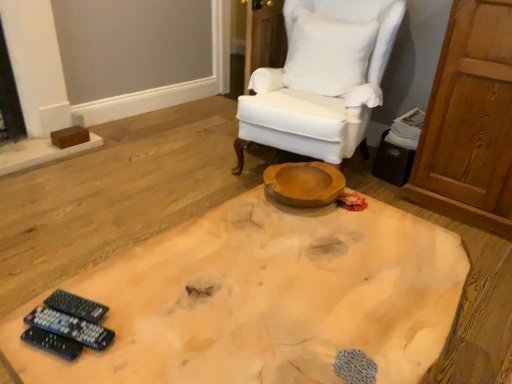
Question: Is black plastic remote controls at lower left, the 1th remote control viewed from the back, next to natural wood coffee table at center?

Choices:
 (A) yes
 (B) no

Answer: (B)

Question: Is black plastic remote controls at lower left, the 1th remote control viewed from the back, bigger than natural wood coffee table at center?

Choices:
 (A) no
 (B) yes

Answer: (A)

Question: Is black plastic remote controls at lower left, the 3th remote control positioned from the front, at the right side of natural wood coffee table at center?

Choices:
 (A) no
 (B) yes

Answer: (A)

Question: Is black plastic remote controls at lower left, the 1th remote control viewed from the back, turned away from natural wood coffee table at center?

Choices:
 (A) no
 (B) yes

Answer: (A)

Question: From the image's perspective, does black plastic remote controls at lower left, the 3th remote control positioned from the front, appear higher than natural wood coffee table at center?

Choices:
 (A) no
 (B) yes

Answer: (B)

Question: From a real-world perspective, relative to black plastic remote controls at lower left, the 3th remote control positioned from the front, is black plastic remote controls at lower left, the 2th remote control viewed from the back, vertically above or below?

Choices:
 (A) above
 (B) below

Answer: (A)

Question: From the image's perspective, is black plastic remote controls at lower left, the 2th remote control viewed from the back, above or below black plastic remote controls at lower left, the 1th remote control viewed from the back?

Choices:
 (A) below
 (B) above

Answer: (A)

Question: Considering the relative positions of black plastic remote controls at lower left, the 2th remote control viewed from the back, and black plastic remote controls at lower left, the 3th remote control positioned from the front, in the image provided, is black plastic remote controls at lower left, the 2th remote control viewed from the back, to the left or to the right of black plastic remote controls at lower left, the 3th remote control positioned from the front,?

Choices:
 (A) left
 (B) right

Answer: (B)

Question: Is black plastic remote controls at lower left, which is counted as the 2th remote control, starting from the front, situated inside black plastic remote controls at lower left, the 1th remote control viewed from the back, or outside?

Choices:
 (A) outside
 (B) inside

Answer: (A)

Question: Is white cotton pillow at upper right in front of or behind white fabric chair at upper center in the image?

Choices:
 (A) front
 (B) behind

Answer: (B)

Question: Does point (298, 28) appear closer or farther from the camera than point (309, 132)?

Choices:
 (A) farther
 (B) closer

Answer: (A)

Question: From the image's perspective, relative to white fabric chair at upper center, is white cotton pillow at upper right above or below?

Choices:
 (A) above
 (B) below

Answer: (A)

Question: Visually, is white cotton pillow at upper right positioned to the left or to the right of white fabric chair at upper center?

Choices:
 (A) right
 (B) left

Answer: (A)

Question: From a real-world perspective, is black plastic remote controls at lower left, which ranks as the 3th remote control in back-to-front order, positioned above or below white fabric chair at upper center?

Choices:
 (A) below
 (B) above

Answer: (A)

Question: Looking at the image, does black plastic remote controls at lower left, which ranks as the 3th remote control in back-to-front order, seem bigger or smaller compared to white fabric chair at upper center?

Choices:
 (A) small
 (B) big

Answer: (A)